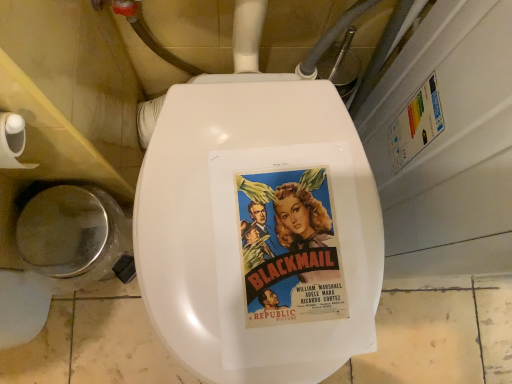
Question: Can we say shiny silver lid at lower left lies outside vintage paper poster at center?

Choices:
 (A) no
 (B) yes

Answer: (B)

Question: Can you confirm if shiny silver lid at lower left is shorter than vintage paper poster at center?

Choices:
 (A) yes
 (B) no

Answer: (B)

Question: Is shiny silver lid at lower left in front of vintage paper poster at center?

Choices:
 (A) yes
 (B) no

Answer: (B)

Question: Is shiny silver lid at lower left taller than vintage paper poster at center?

Choices:
 (A) yes
 (B) no

Answer: (A)

Question: Is shiny silver lid at lower left further to camera compared to vintage paper poster at center?

Choices:
 (A) no
 (B) yes

Answer: (B)

Question: Is white matte toilet paper at left bigger or smaller than shiny silver lid at lower left?

Choices:
 (A) big
 (B) small

Answer: (B)

Question: From their relative heights in the image, would you say white matte toilet paper at left is taller or shorter than shiny silver lid at lower left?

Choices:
 (A) tall
 (B) short

Answer: (B)

Question: Is white matte toilet paper at left spatially inside shiny silver lid at lower left, or outside of it?

Choices:
 (A) inside
 (B) outside

Answer: (B)

Question: Is white matte toilet paper at left wider or thinner than shiny silver lid at lower left?

Choices:
 (A) thin
 (B) wide

Answer: (A)

Question: Is white matte toilet paper at left bigger or smaller than vintage paper poster at center?

Choices:
 (A) small
 (B) big

Answer: (B)

Question: Looking at their shapes, would you say white matte toilet paper at left is wider or thinner than vintage paper poster at center?

Choices:
 (A) thin
 (B) wide

Answer: (A)

Question: Is point (24, 162) closer or farther from the camera than point (297, 180)?

Choices:
 (A) closer
 (B) farther

Answer: (B)

Question: From a real-world perspective, is white matte toilet paper at left physically located above or below vintage paper poster at center?

Choices:
 (A) below
 (B) above

Answer: (B)

Question: Which is correct: vintage paper poster at center is inside shiny silver lid at lower left, or outside of it?

Choices:
 (A) outside
 (B) inside

Answer: (A)

Question: From the image's perspective, is vintage paper poster at center above or below shiny silver lid at lower left?

Choices:
 (A) above
 (B) below

Answer: (A)